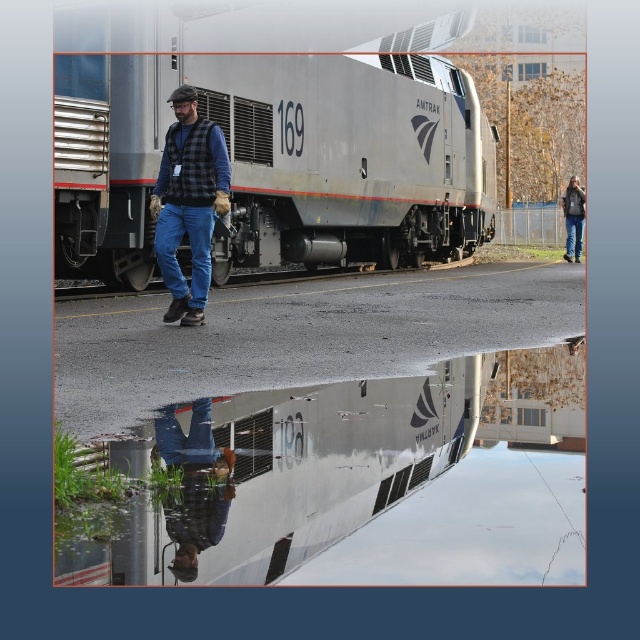
Is the position of brushed metal train at center less distant than that of blue jeans at lower left?

That is False.

Between brushed metal train at center and blue jeans at lower left, which one is positioned higher?

brushed metal train at center is above.

Is point (60, 198) positioned after point (209, 470)?

Yes.

Where is `brushed metal train at center`? Image resolution: width=640 pixels, height=640 pixels. brushed metal train at center is located at coordinates (269, 148).

Between blue jeans at lower left and denim jacket at upper right, which one appears on the left side from the viewer's perspective?

Positioned to the left is blue jeans at lower left.

The image size is (640, 640). What do you see at coordinates (195, 483) in the screenshot? I see `blue jeans at lower left` at bounding box center [195, 483].

Who is more distant from viewer, (x=177, y=436) or (x=570, y=208)?

Positioned behind is point (x=570, y=208).

You are a GUI agent. You are given a task and a screenshot of the screen. Output one action in this format:
    pyautogui.click(x=<x>, y=<y>)
    Task: Click on the blue jeans at lower left
    
    Given the screenshot: What is the action you would take?
    pyautogui.click(x=195, y=483)

Does brushed metal train at center appear on the left side of denim jacket at upper right?

Indeed, brushed metal train at center is positioned on the left side of denim jacket at upper right.

Is point (294, 113) more distant than point (563, 259)?

That is False.

Where is `brushed metal train at center`? brushed metal train at center is located at coordinates (269, 148).